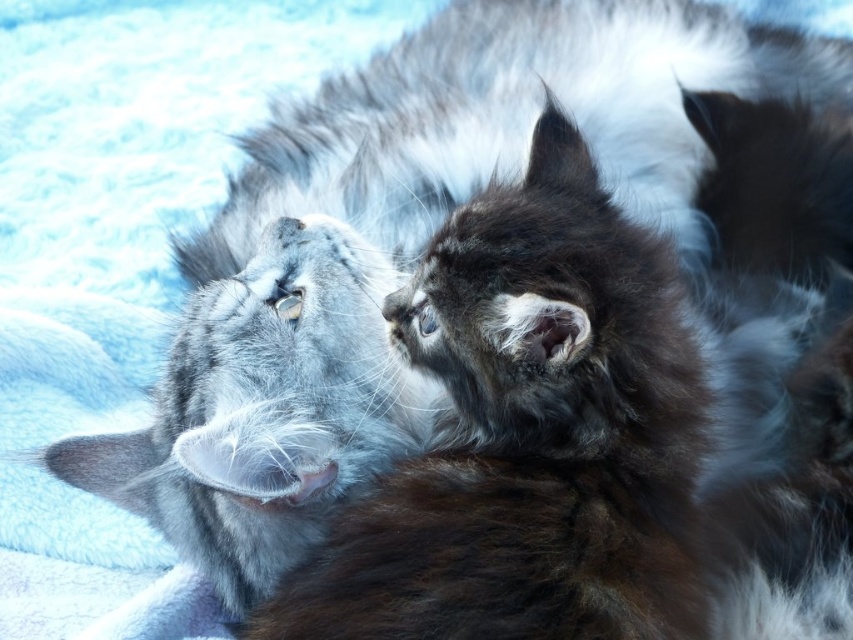
You are a photographer standing at the point marked by the coordinates point (529, 435). You want to capture a photo of the fluffy gray cat at center. Which direction should you move to get a better shot?

The point (529, 435) indicates the location of the fluffy gray cat at center, so you are already at the correct position to capture the photo.

You are a photographer trying to capture a closeup of the soft fur cat at upper left and the fluffy brown fur at right. Since you can only focus on one cat at a time, which cat should you focus on to ensure the other remains in the background?

You should focus on the fluffy brown fur at right because the soft fur cat at upper left is shorter, so it will be in the background when focusing on the taller one.

You are a photographer trying to capture a closeup of both the fluffy gray cat at center and the fluffy brown fur at right. Since your camera can only focus on one subject at a time, which cat should you choose to ensure the wider one is in focus?

The fluffy gray cat at center is wider than the fluffy brown fur at right, so you should focus on the fluffy gray cat at center to ensure the wider one is in focus.